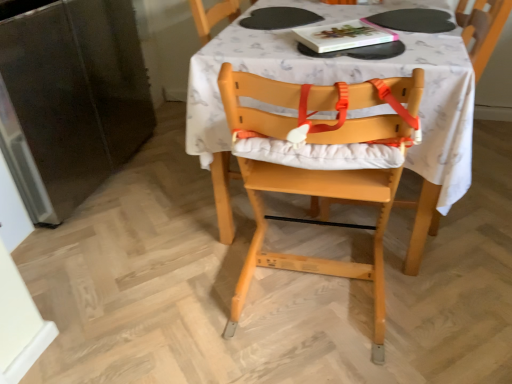
You are a GUI agent. You are given a task and a screenshot of the screen. Output one action in this format:
    pyautogui.click(x=<x>, y=<y>)
    Task: Click on the free space between white fabric table at center and natural wood highchair at center
    
    Given the screenshot: What is the action you would take?
    pyautogui.click(x=308, y=297)